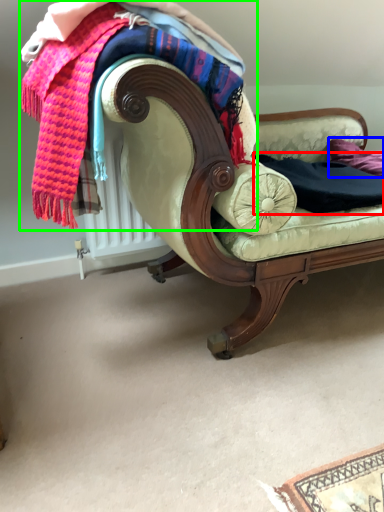
Question: Considering the real-world distances, which object is farthest from clothing (highlighted by a red box)? pillow (highlighted by a blue box) or laundry (highlighted by a green box)?

Choices:
 (A) pillow
 (B) laundry

Answer: (B)